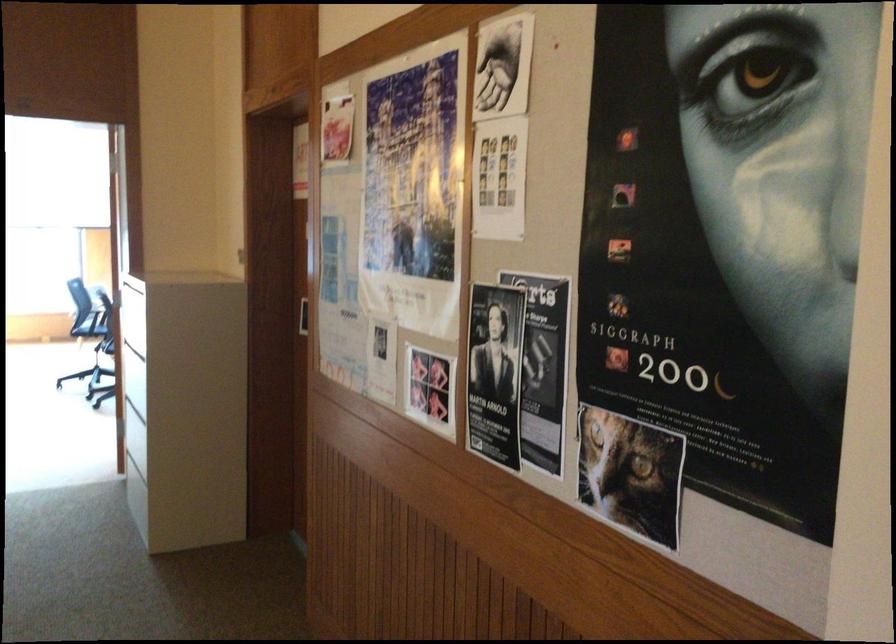
This screenshot has height=644, width=896. What do you see at coordinates (83, 323) in the screenshot?
I see `the chair sitting surface` at bounding box center [83, 323].